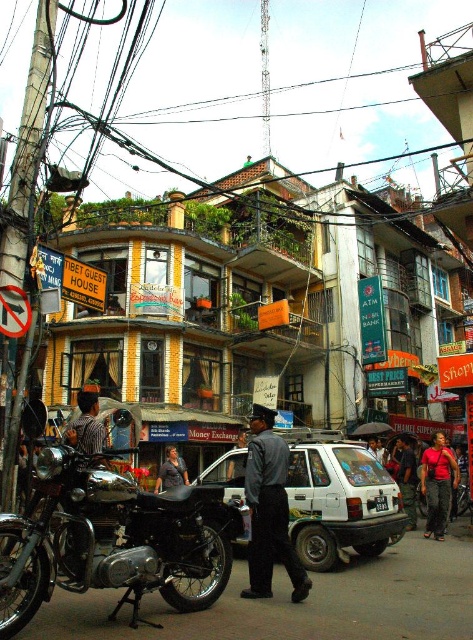
How much distance is there between shiny chrome motorcycle at center-left and dark blue uniform at center?

A distance of 9.14 meters exists between shiny chrome motorcycle at center-left and dark blue uniform at center.

Can you confirm if shiny chrome motorcycle at center-left is positioned below dark blue uniform at center?

Incorrect, shiny chrome motorcycle at center-left is not positioned below dark blue uniform at center.

Identify the location of shiny chrome motorcycle at center-left. (111, 538).

Can you confirm if dark blue uniform at center is shorter than dark gray shirt at center?

In fact, dark blue uniform at center may be taller than dark gray shirt at center.

Who is lower down, dark blue uniform at center or dark gray shirt at center?

dark gray shirt at center is below.

Find the location of `dark blue uniform at center`. dark blue uniform at center is located at coordinates (269, 509).

You are a GUI agent. You are given a task and a screenshot of the screen. Output one action in this format:
    pyautogui.click(x=<x>, y=<y>)
    Task: Click on the dark blue uniform at center
    
    Given the screenshot: What is the action you would take?
    pyautogui.click(x=269, y=509)

Which of these two, white matte car at center or dark gray shirt at center, stands shorter?

With less height is dark gray shirt at center.

Does white matte car at center have a lesser height compared to dark gray shirt at center?

No, white matte car at center is not shorter than dark gray shirt at center.

Who is more distant from viewer, (303, 474) or (177, 456)?

Positioned behind is point (177, 456).

Image resolution: width=473 pixels, height=640 pixels. I want to click on white matte car at center, so click(x=339, y=500).